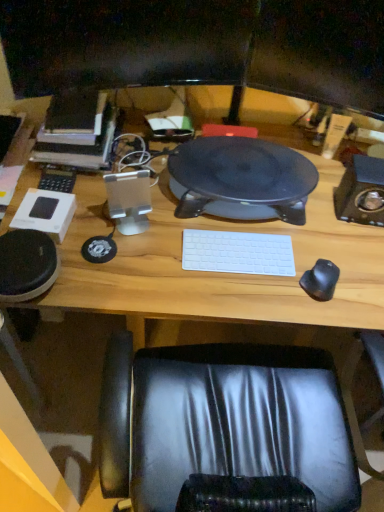
This screenshot has height=512, width=384. I want to click on free region under white matte keyboard at center (from a real-world perspective), so click(x=236, y=254).